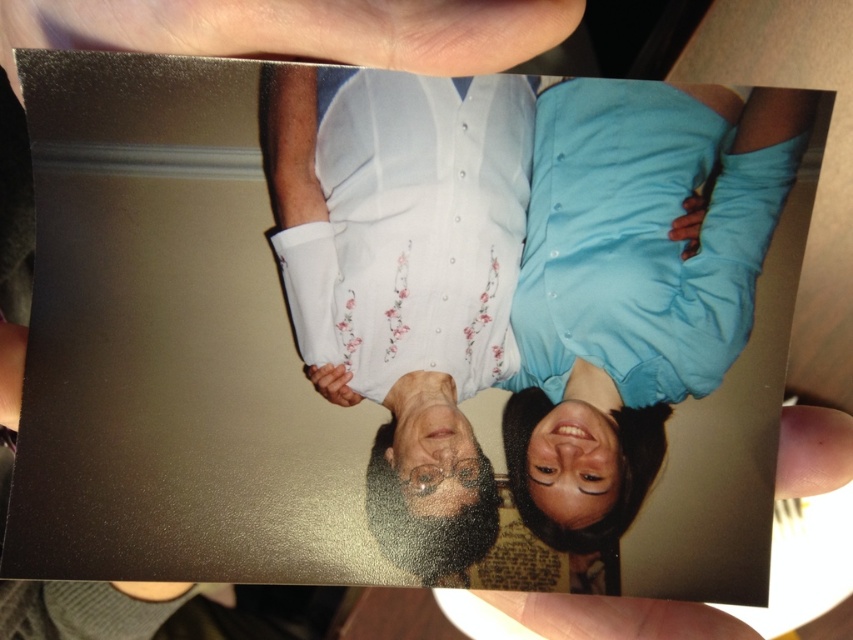
In the scene shown: Looking at the image, which object is taller between the white floral shirt at center and the metallic silver hand at upper center?

The white floral shirt at center is much taller than the metallic silver hand at upper center.